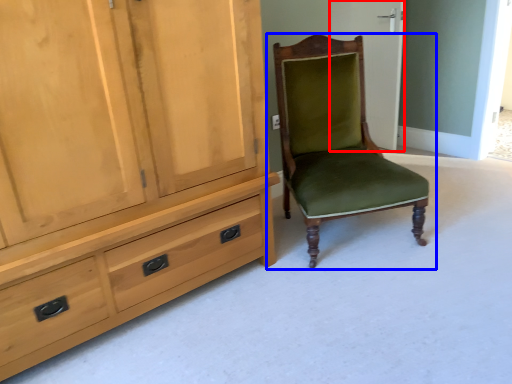
Question: Among these objects, which one is farthest to the camera, screen door (highlighted by a red box) or chair (highlighted by a blue box)?

Choices:
 (A) screen door
 (B) chair

Answer: (A)